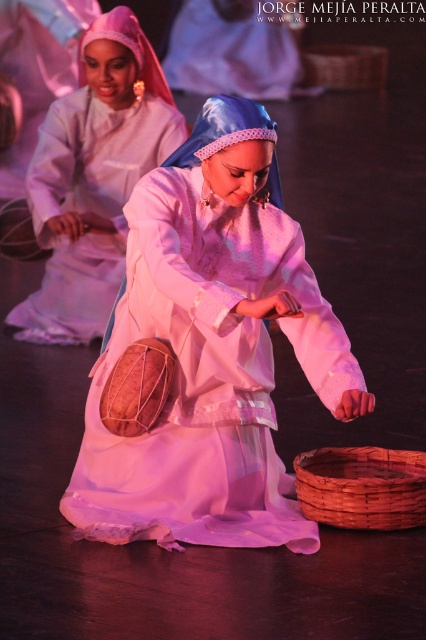
You are a stagehand adjusting the spotlight for the performance. The spotlight can only illuminate a circular area with a radius of 0.5 units centered at point A. If the center of the spotlight needs to be placed at point A to ensure the matte white dress at center is fully within the illuminated area, where should point A be positioned relative to the dress?

The matte white dress at center is located at point (212, 349), so point A should be positioned at the same coordinates as the dress to ensure it is fully within the spotlight area.

In the image, there are two items at the center of the stage, a matte white dress at center and a matte white fabric at center. Which one is positioned to the right?

The matte white dress at center is positioned to the right of the matte white fabric at center.